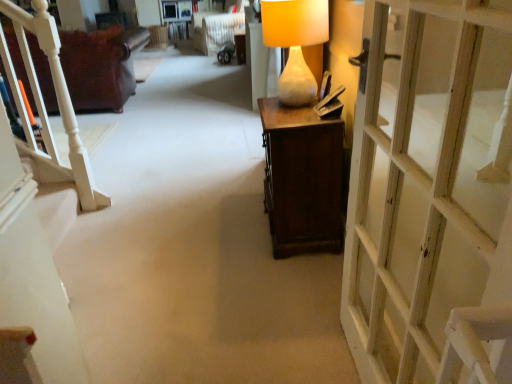
Question: Based on their positions, is matte white vase at center located to the left or right of leather couch at left?

Choices:
 (A) left
 (B) right

Answer: (B)

Question: In the image, is matte white vase at center positioned in front of or behind leather couch at left?

Choices:
 (A) front
 (B) behind

Answer: (A)

Question: Estimate the real-world distances between objects in this image. Which object is farther from the white textured armchair at upper center?

Choices:
 (A) matte white vase at center
 (B) white wooden door at right
 (C) leather couch at left

Answer: (B)

Question: Considering the real-world distances, which object is farthest from the white wooden door at right?

Choices:
 (A) leather couch at left
 (B) white textured armchair at upper center
 (C) matte white vase at center

Answer: (B)